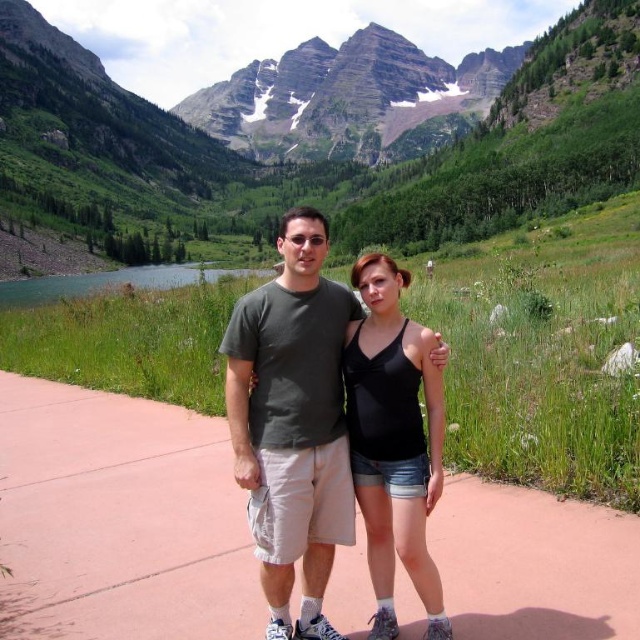
Question: Which of the following is the farthest from the observer?

Choices:
 (A) green grassy mountain at center
 (B) black matte tank top at center
 (C) pink concrete sidewalk at center

Answer: (A)

Question: Does green grassy mountain at center have a smaller size compared to black matte tank top at center?

Choices:
 (A) yes
 (B) no

Answer: (B)

Question: Based on their relative distances, which object is farther from the pink concrete sidewalk at center?

Choices:
 (A) green smooth water at center
 (B) green grassy mountain at center

Answer: (B)

Question: Which of these objects is positioned farthest from the green grassy mountain at center?

Choices:
 (A) pink concrete sidewalk at center
 (B) black matte tank top at center
 (C) green smooth water at center

Answer: (A)

Question: Does green grassy mountain at center appear over pink concrete sidewalk at center?

Choices:
 (A) no
 (B) yes

Answer: (B)

Question: Is green grassy mountain at center positioned before pink concrete sidewalk at center?

Choices:
 (A) no
 (B) yes

Answer: (A)